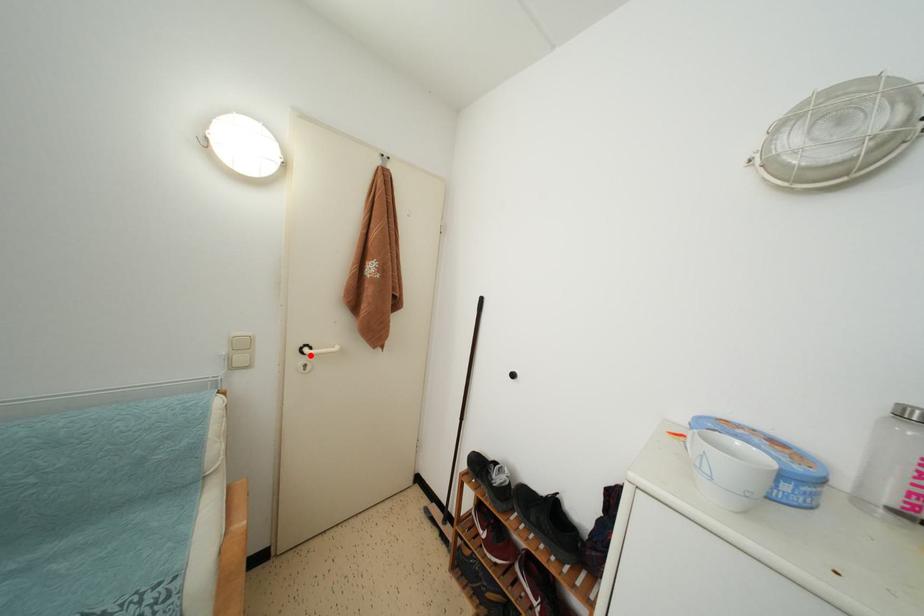
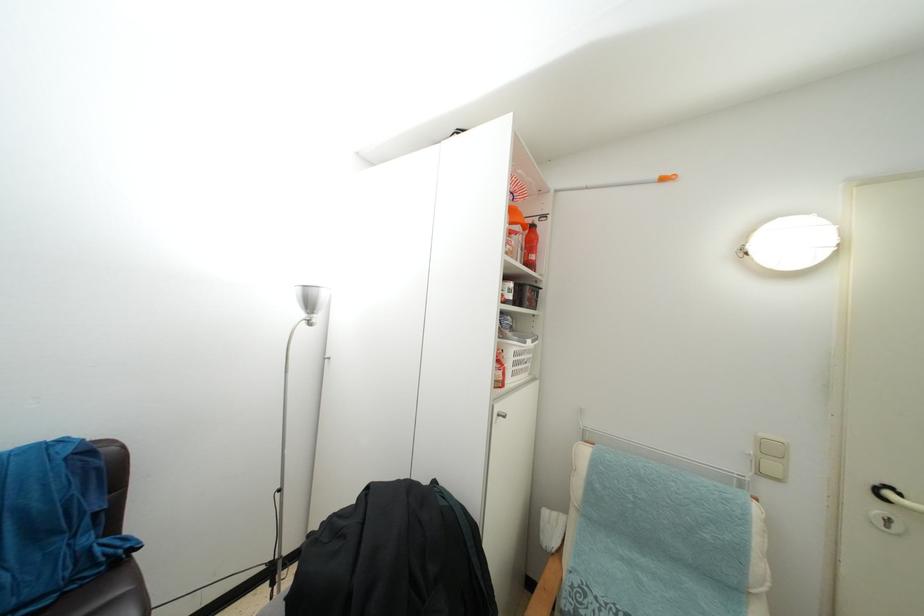
Question: A red point is marked in image1. In image2, is the corresponding 3D point closer to the camera or farther? Reply with the corresponding letter.

Choices:
 (A) The corresponding 3D point is closer.
 (B) The corresponding 3D point is farther.

Answer: (A)